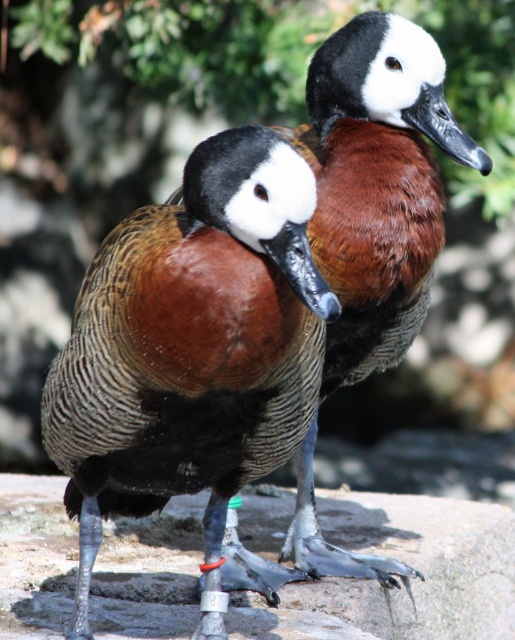
Does gray stone at center have a greater width compared to brown feathered duck at center?

Yes, gray stone at center is wider than brown feathered duck at center.

Does point (133, 609) come closer to viewer compared to point (373, 177)?

No, (133, 609) is behind (373, 177).

Is point (31, 611) farther from viewer compared to point (445, 128)?

Yes.

What are the coordinates of `gray stone at center` in the screenshot? It's located at (403, 586).

Which is above, brown speckled duck at center or brown feathered duck at center?

brown feathered duck at center is above.

The image size is (515, 640). Describe the element at coordinates (191, 346) in the screenshot. I see `brown speckled duck at center` at that location.

Find the location of a particular element. Image resolution: width=515 pixels, height=640 pixels. brown speckled duck at center is located at coordinates (191, 346).

Does brown speckled duck at center have a greater width compared to gray stone at center?

No.

Does brown speckled duck at center have a larger size compared to gray stone at center?

No, brown speckled duck at center is not bigger than gray stone at center.

Find the location of a particular element. Image resolution: width=515 pixels, height=640 pixels. brown speckled duck at center is located at coordinates (191, 346).